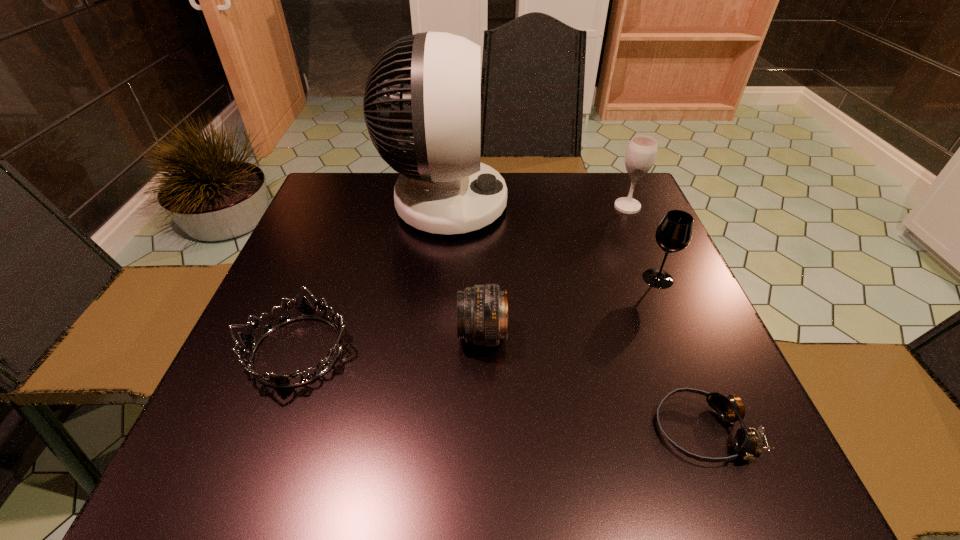
Identify the location of the tallest object. (443, 188).

Where is `the farther wineglass`? Image resolution: width=960 pixels, height=540 pixels. the farther wineglass is located at coordinates (641, 152).

Where is `the third farthest object`? the third farthest object is located at coordinates (674, 233).

You are a GUI agent. You are given a task and a screenshot of the screen. Output one action in this format:
    pyautogui.click(x=<x>, y=<y>)
    Task: Click on the fourth tallest object
    The height and width of the screenshot is (540, 960).
    Given the screenshot: What is the action you would take?
    pyautogui.click(x=482, y=311)

Locate an element on the screen. the fifth tallest object is located at coordinates (306, 310).

The width and height of the screenshot is (960, 540). Find the location of `goggles`. goggles is located at coordinates click(748, 442).

Locate an element on the screen. This screenshot has height=540, width=960. free space located on the grille of the tallest object is located at coordinates (628, 204).

Locate an element on the screen. This screenshot has height=540, width=960. free space located on the left of the farther wineglass is located at coordinates [522, 207].

This screenshot has height=540, width=960. Find the location of `free space located 0.210m on the front of the nearer wineglass`. free space located 0.210m on the front of the nearer wineglass is located at coordinates (698, 373).

Where is `blank area located at the front element of the third shortest object`? This screenshot has height=540, width=960. blank area located at the front element of the third shortest object is located at coordinates (422, 335).